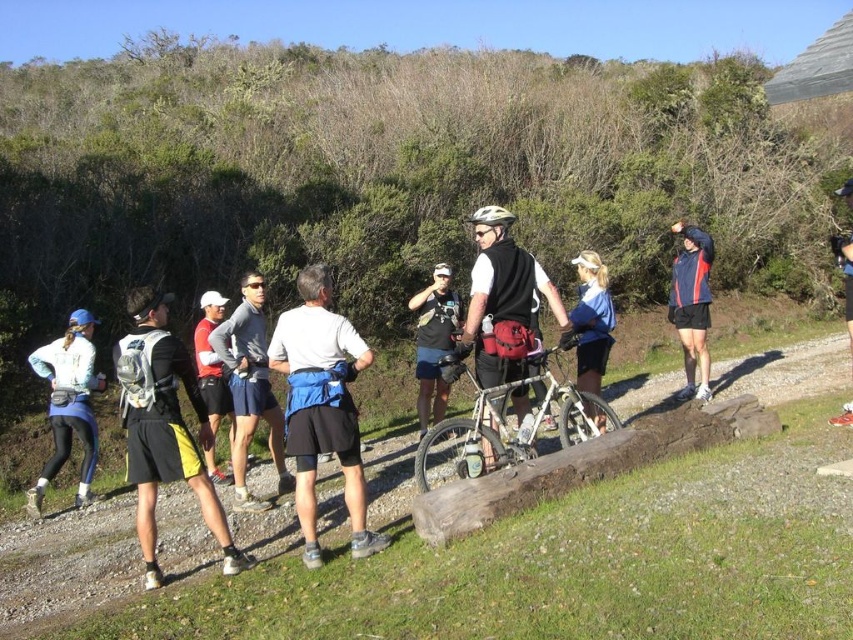
Question: Is silver metallic mountain bike at center wider than matte blue jacket at upper right?

Choices:
 (A) no
 (B) yes

Answer: (B)

Question: Which object appears closest to the camera in this image?

Choices:
 (A) matte blue jacket at upper right
 (B) matte black shorts at left

Answer: (B)

Question: Which object is the farthest from the matte black vest at center?

Choices:
 (A) blue fabric shorts at center
 (B) silver metallic mountain bike at center

Answer: (A)

Question: Does matte black shorts at left appear on the left side of matte blue running suit at left?

Choices:
 (A) yes
 (B) no

Answer: (B)

Question: Which object is positioned closest to the matte blue jacket at upper right?

Choices:
 (A) matte black shorts at left
 (B) blue fabric shirt at center
 (C) blue fabric shorts at center

Answer: (B)

Question: Is matte black shorts at left to the right of silver metallic mountain bike at center from the viewer's perspective?

Choices:
 (A) no
 (B) yes

Answer: (A)